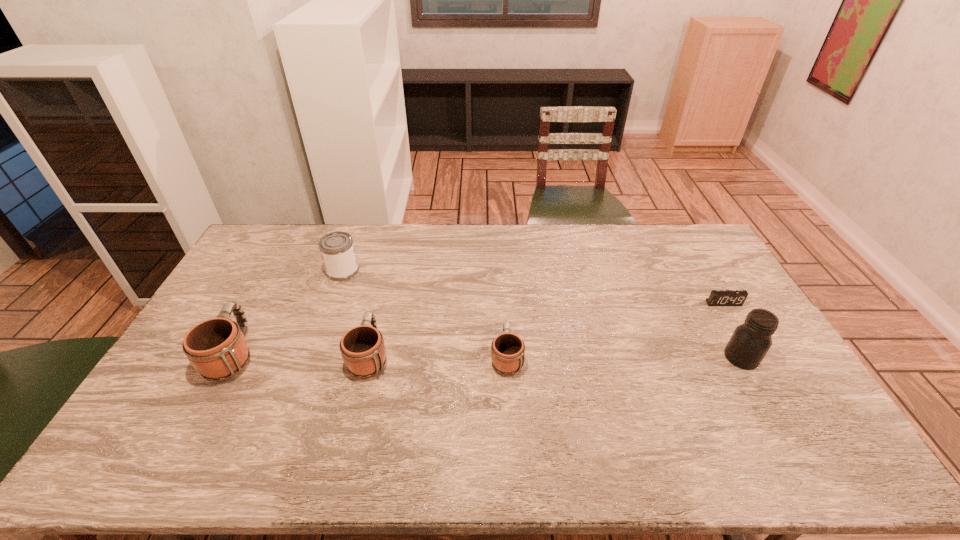
At what (x,y) coordinates should I click in order to perform the action: click on blank space at the far left corner of the desktop. Please return your answer as a coordinate pair (x, y). The height and width of the screenshot is (540, 960). Looking at the image, I should click on (277, 253).

Image resolution: width=960 pixels, height=540 pixels. What are the coordinates of `vacant space at the far right corner` in the screenshot? It's located at (699, 251).

Identify the location of vacant area that lies between the shortest mug and the jar. (624, 357).

What are the coordinates of `empty space that is in between the third object from right to left and the fifth object from right to left` in the screenshot? It's located at (424, 314).

Where is `vacant area that lies between the shortest mug and the farthest object`? vacant area that lies between the shortest mug and the farthest object is located at coordinates (424, 314).

Identify the location of vacant space that's between the tallest mug and the second mug from right to left. (301, 355).

This screenshot has width=960, height=540. Identify the location of free space between the fifth object from right to left and the third object from right to left. (424, 314).

Locate an element on the screen. This screenshot has height=540, width=960. unoccupied position between the jar and the fifth tallest object is located at coordinates (624, 357).

Locate an element on the screen. vacant space in between the leftmost object and the jar is located at coordinates (488, 356).

Find the location of a particular element. Image resolution: width=960 pixels, height=540 pixels. free space that is in between the second farthest object and the fourth object from left to right is located at coordinates (615, 330).